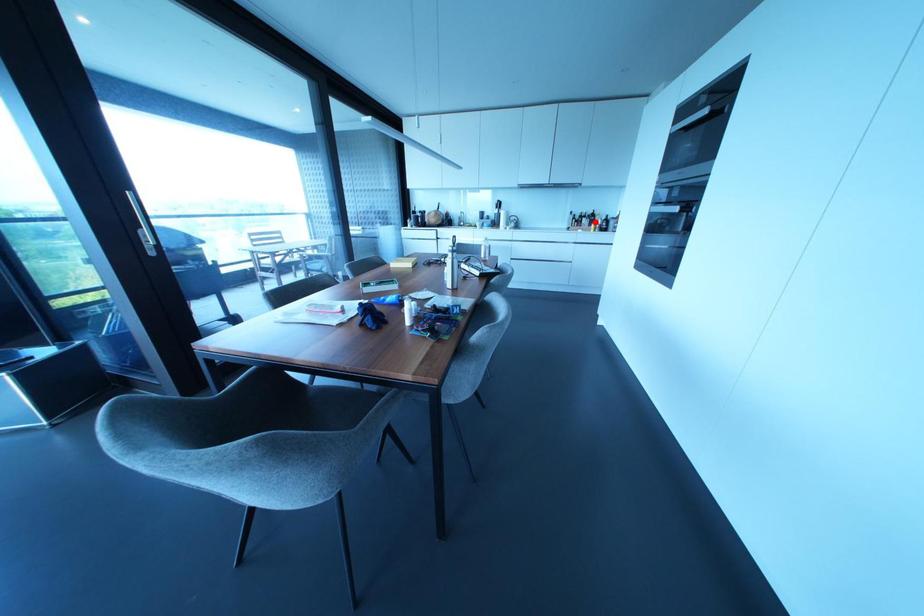
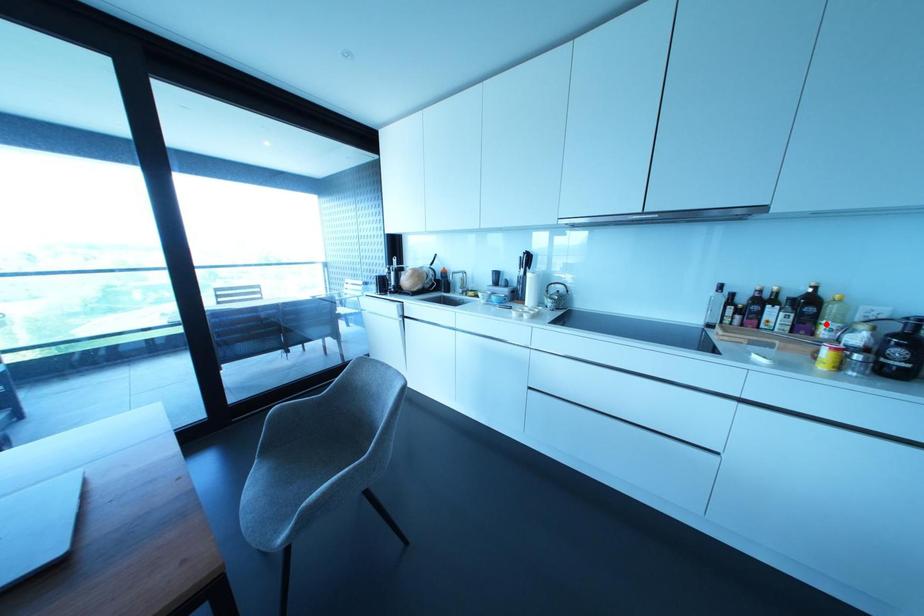
I am providing you with two images of the same scene from different viewpoints. A red point is marked on the first image and another point is marked on the second image. Are the points marked in image1 and image2 representing the same 3D position?

Yes